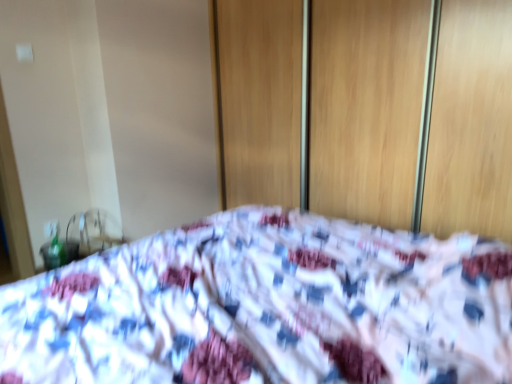
Question: Looking at their shapes, would you say wooden screen door at center is wider or thinner than fluffy fabric bed at center?

Choices:
 (A) thin
 (B) wide

Answer: (A)

Question: From the image's perspective, is wooden screen door at center positioned above or below fluffy fabric bed at center?

Choices:
 (A) above
 (B) below

Answer: (A)

Question: Considering the positions of point (348, 192) and point (336, 286), is point (348, 192) closer or farther from the camera than point (336, 286)?

Choices:
 (A) closer
 (B) farther

Answer: (B)

Question: Looking at the image, does fluffy fabric bed at center seem bigger or smaller compared to wooden screen door at center?

Choices:
 (A) big
 (B) small

Answer: (A)

Question: Would you say fluffy fabric bed at center is to the left or to the right of wooden screen door at center in the picture?

Choices:
 (A) left
 (B) right

Answer: (A)

Question: Is fluffy fabric bed at center in front of or behind wooden screen door at center in the image?

Choices:
 (A) behind
 (B) front

Answer: (B)

Question: From a real-world perspective, is fluffy fabric bed at center positioned above or below wooden screen door at center?

Choices:
 (A) below
 (B) above

Answer: (A)